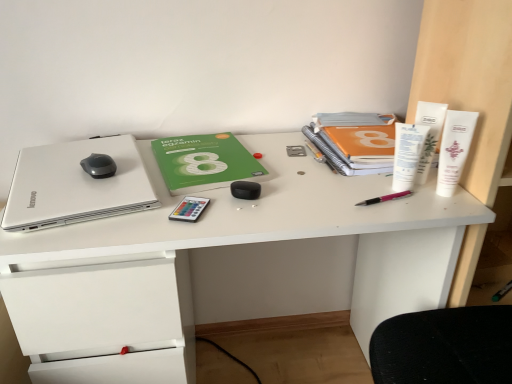
Where is `vacant space situated on the left part of white plastic tube at upper right, the 2th stationery positioned from the right`? The width and height of the screenshot is (512, 384). vacant space situated on the left part of white plastic tube at upper right, the 2th stationery positioned from the right is located at coordinates (339, 183).